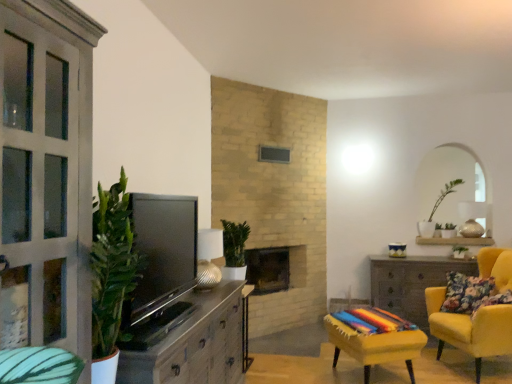
Question: Considering the relative sizes of green matte plant at upper right, which ranks as the first houseplant in right-to-left order, and metallic ribbed lampshade at center in the image provided, is green matte plant at upper right, which ranks as the first houseplant in right-to-left order, shorter than metallic ribbed lampshade at center?

Choices:
 (A) yes
 (B) no

Answer: (B)

Question: From a real-world perspective, is green matte plant at upper right, which is the 2th houseplant in left-to-right order, located higher than metallic ribbed lampshade at center?

Choices:
 (A) no
 (B) yes

Answer: (B)

Question: From the image's perspective, is green matte plant at upper right, which is the 2th houseplant in left-to-right order, below metallic ribbed lampshade at center?

Choices:
 (A) no
 (B) yes

Answer: (A)

Question: Is metallic ribbed lampshade at center located within green matte plant at upper right, which is the 2th houseplant in left-to-right order?

Choices:
 (A) no
 (B) yes

Answer: (A)

Question: From the image's perspective, would you say green matte plant at upper right, which ranks as the first houseplant in right-to-left order, is positioned over metallic ribbed lampshade at center?

Choices:
 (A) no
 (B) yes

Answer: (B)

Question: Is green matte plant at upper right, which is the 2th houseplant in left-to-right order, closer to camera compared to metallic ribbed lampshade at center?

Choices:
 (A) no
 (B) yes

Answer: (A)

Question: Is green leafy plant at center-right turned away from matte black tv at left?

Choices:
 (A) no
 (B) yes

Answer: (A)

Question: From a real-world perspective, is green leafy plant at center-right located higher than matte black tv at left?

Choices:
 (A) yes
 (B) no

Answer: (B)

Question: Can you confirm if green leafy plant at center-right is positioned to the right of matte black tv at left?

Choices:
 (A) yes
 (B) no

Answer: (A)

Question: From the image's perspective, is green leafy plant at center-right beneath matte black tv at left?

Choices:
 (A) no
 (B) yes

Answer: (B)

Question: Is green leafy plant at center-right taller than matte black tv at left?

Choices:
 (A) yes
 (B) no

Answer: (B)

Question: Is green leafy plant at center-right thinner than matte black tv at left?

Choices:
 (A) no
 (B) yes

Answer: (B)

Question: Could brick fireplace at center be considered to be inside green matte plant at center, the second houseplant from the right?

Choices:
 (A) no
 (B) yes

Answer: (A)